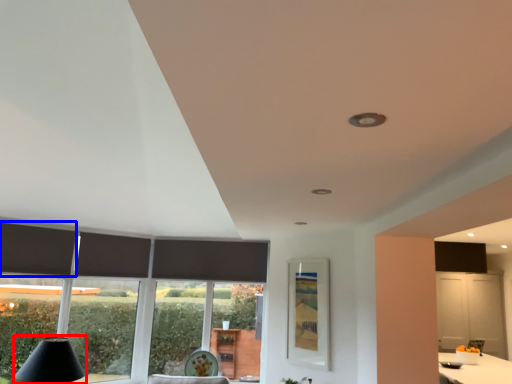
Question: Which object appears closest to the camera in this image, table lamp (highlighted by a red box) or curtain (highlighted by a blue box)?

Choices:
 (A) table lamp
 (B) curtain

Answer: (A)